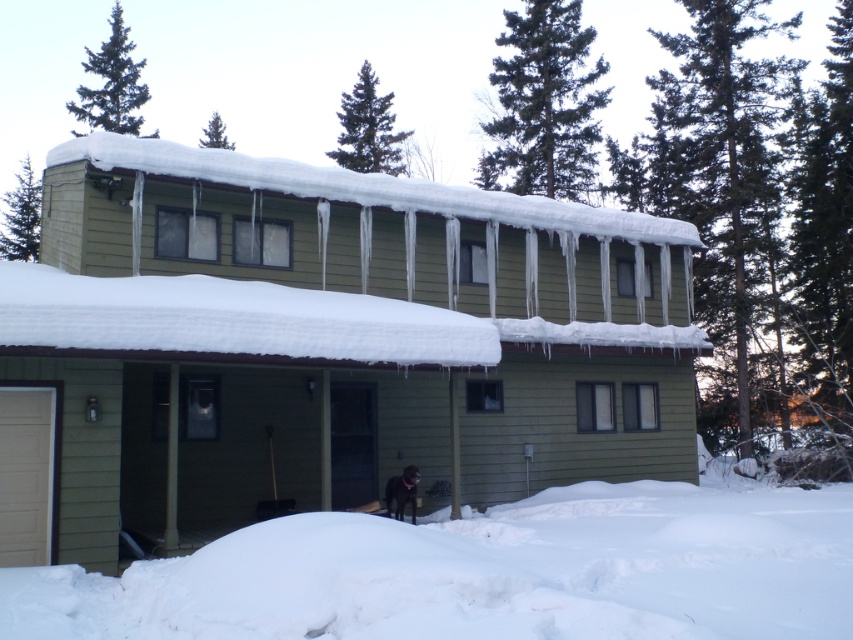
Question: Is white fluffy snow at lower center bigger than snow-covered wood at upper center?

Choices:
 (A) no
 (B) yes

Answer: (A)

Question: Which point is closer to the camera?

Choices:
 (A) white fluffy snow at lower center
 (B) snow-covered wood at upper center

Answer: (A)

Question: Is white fluffy snow at lower center smaller than snow-covered wood at upper center?

Choices:
 (A) yes
 (B) no

Answer: (A)

Question: Can you confirm if white fluffy snow at lower center is positioned above snow-covered wood at upper center?

Choices:
 (A) yes
 (B) no

Answer: (B)